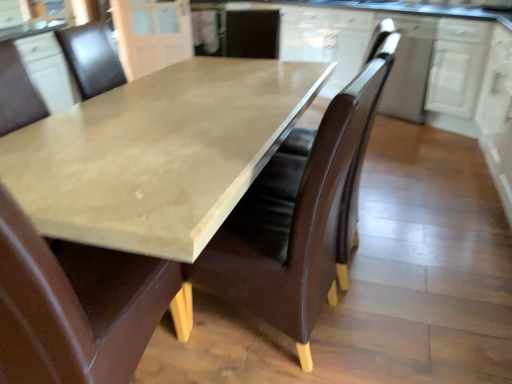
Where is `empty space that is ontop of matte concrete countertop at center`? This screenshot has width=512, height=384. empty space that is ontop of matte concrete countertop at center is located at coordinates (152, 140).